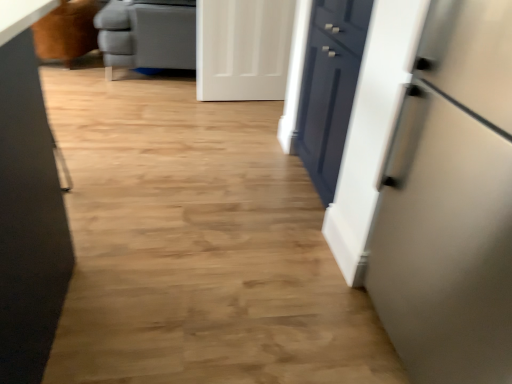
Find the location of a particular element. This screenshot has width=512, height=384. free space on the front side of glossy dark blue drawer at center right is located at coordinates (283, 225).